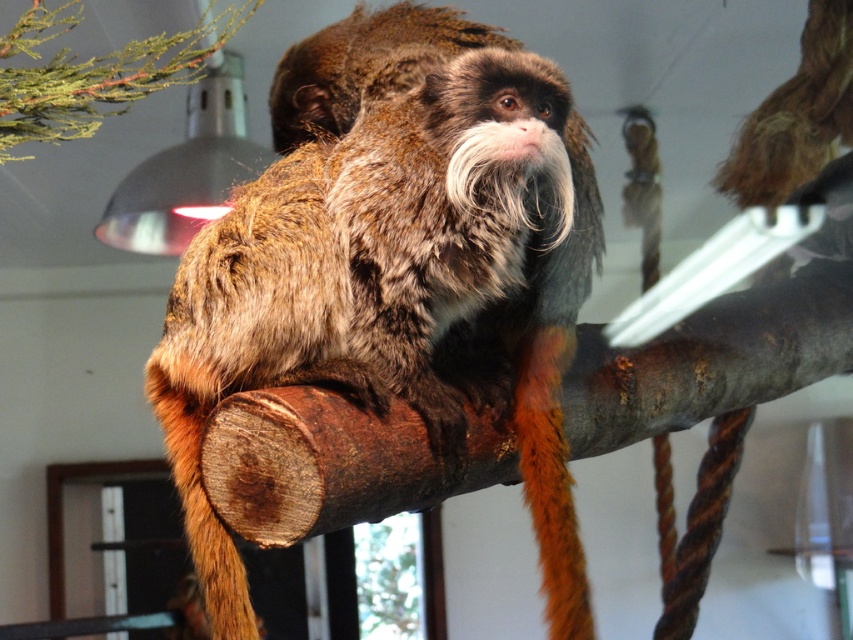
Based on the photo, between brown furry monkey at center and green leafy branch at upper left, which one is positioned lower?

brown furry monkey at center is lower down.

Between brown furry monkey at center and green leafy branch at upper left, which one is positioned higher?

green leafy branch at upper left is higher up.

Find the location of a particular element. brown furry monkey at center is located at coordinates (375, 262).